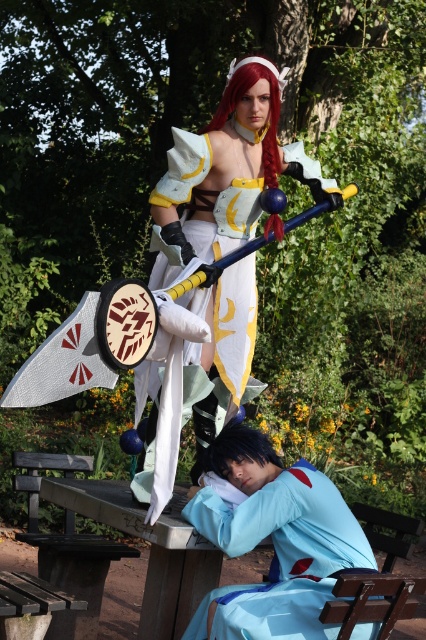
Question: Which of the following is the closest to the observer?

Choices:
 (A) (348, 554)
 (B) (279, 172)

Answer: (A)

Question: Can you confirm if white satin dress at center is wider than light blue fabric at lower center?

Choices:
 (A) yes
 (B) no

Answer: (A)

Question: Does white satin dress at center have a larger size compared to light blue fabric at lower center?

Choices:
 (A) yes
 (B) no

Answer: (A)

Question: Which object is farther from the camera taking this photo?

Choices:
 (A) white satin dress at center
 (B) light blue fabric at lower center

Answer: (A)

Question: Is white satin dress at center wider than light blue fabric at lower center?

Choices:
 (A) no
 (B) yes

Answer: (B)

Question: Which point is closer to the camera?

Choices:
 (A) (201, 346)
 (B) (236, 545)

Answer: (B)